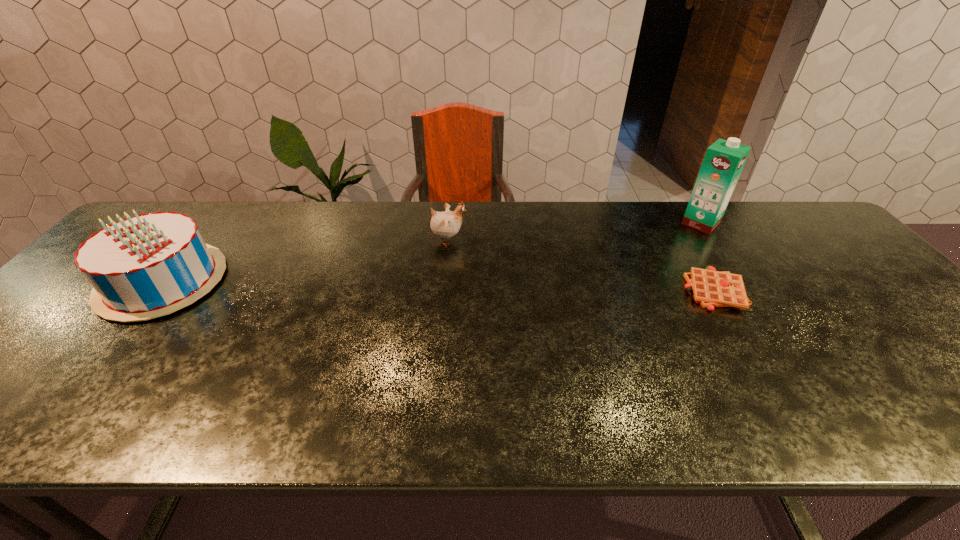
The height and width of the screenshot is (540, 960). Find the location of `vacant space that satisfies the following two spatial constraints: 1. at the beak of the third object from right to left; 2. on the left side of the shortest object`. vacant space that satisfies the following two spatial constraints: 1. at the beak of the third object from right to left; 2. on the left side of the shortest object is located at coordinates (444, 291).